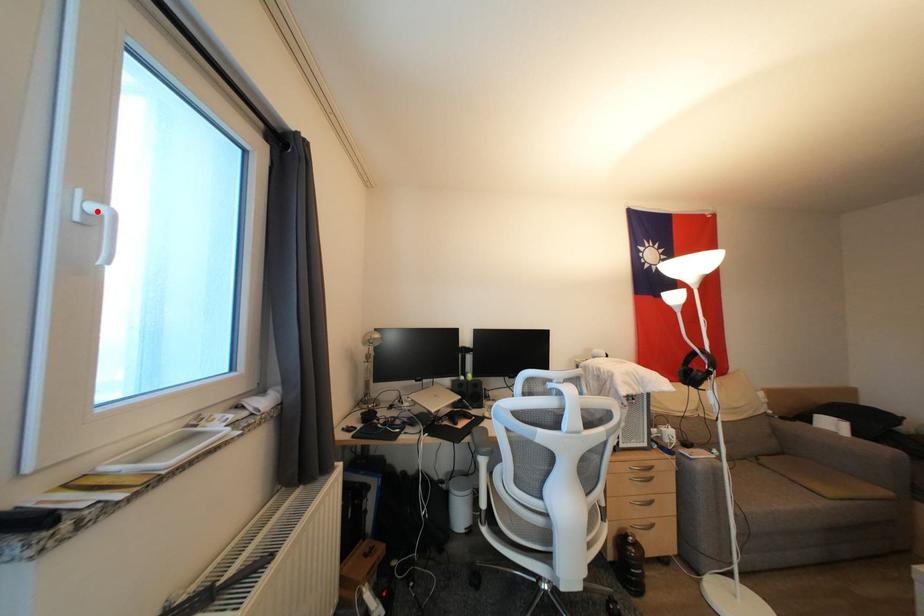
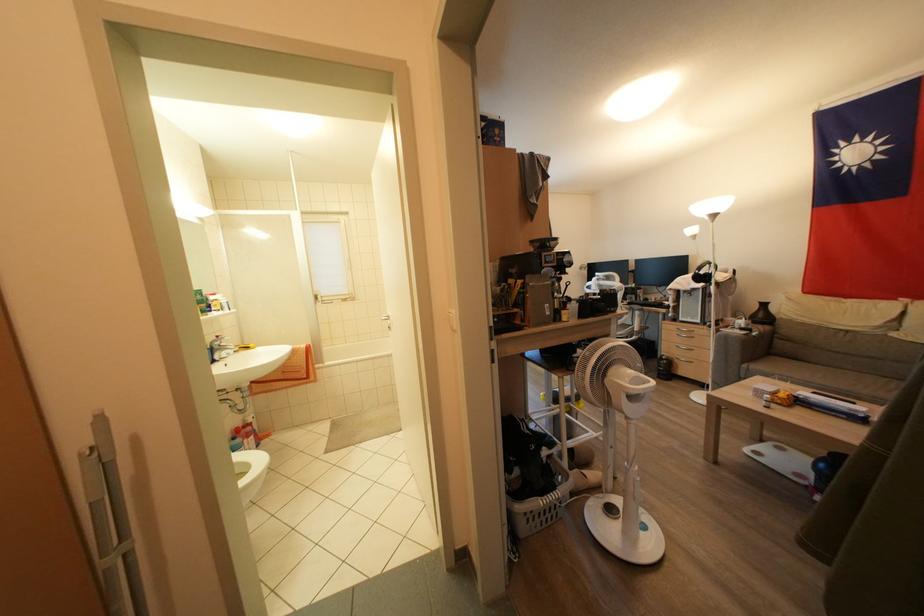
Question: I am providing you with two images of the same scene from different viewpoints. A red point is marked on the first image. Is the red point's position out of view in image 2?

Choices:
 (A) Yes
 (B) No

Answer: (A)